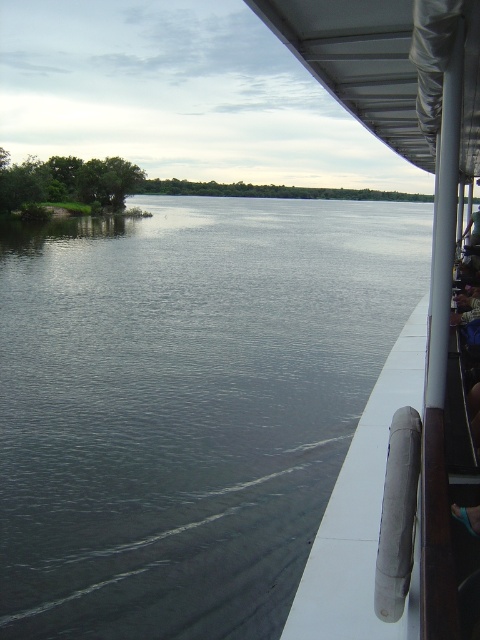
Is point (196, 561) farther from camera compared to point (459, 106)?

Yes, point (196, 561) is behind point (459, 106).

Does gray smooth water at center have a smaller size compared to white rubber handrail at right?

Incorrect, gray smooth water at center is not smaller in size than white rubber handrail at right.

Which is in front, point (95, 394) or point (365, 61)?

Positioned in front is point (365, 61).

In order to click on gray smooth water at center in this screenshot , I will do `click(186, 404)`.